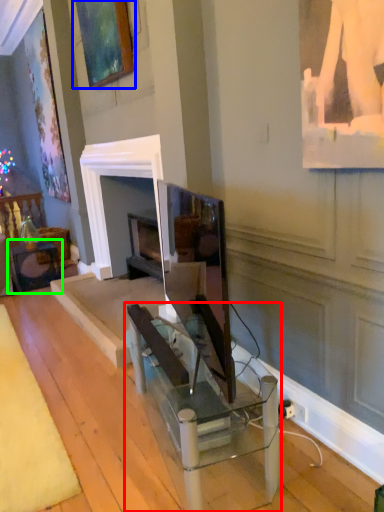
Question: Based on their relative distances, which object is farther from table (highlighted by a red box)? Choose from picture frame (highlighted by a blue box) and table (highlighted by a green box).

Choices:
 (A) picture frame
 (B) table

Answer: (B)